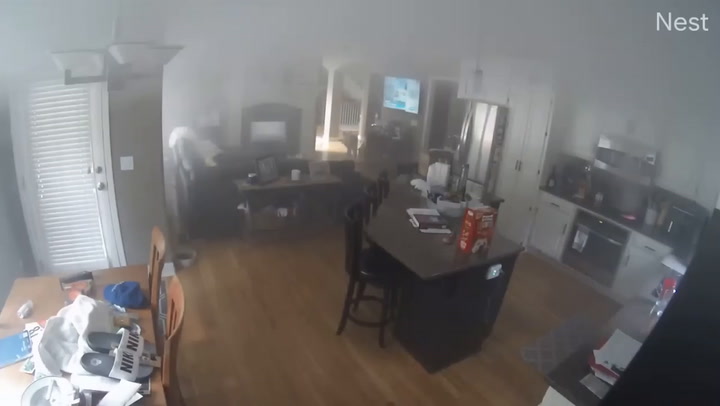
Find the location of a particular element. counter is located at coordinates (432, 269).